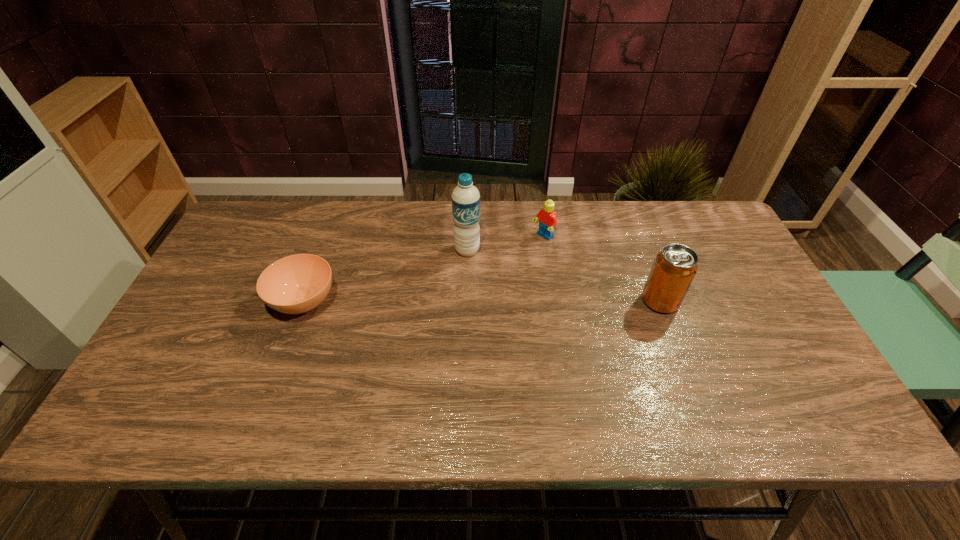
The height and width of the screenshot is (540, 960). Identify the location of vacant point located between the tallest object and the soup bowl. (386, 276).

Identify the location of empty location between the second shortest object and the rightmost object. (601, 269).

You are a GUI agent. You are given a task and a screenshot of the screen. Output one action in this format:
    pyautogui.click(x=<x>, y=<y>)
    Task: Click on the vacant region between the soda can and the second object from left to right
    This screenshot has width=960, height=540.
    Given the screenshot: What is the action you would take?
    pyautogui.click(x=564, y=276)

The height and width of the screenshot is (540, 960). What are the coordinates of `free space between the second tallest object and the shortest object` in the screenshot? It's located at (482, 301).

This screenshot has width=960, height=540. Identify the location of object that is the third closest to the soup bowl. (674, 268).

Find the location of a particular element. The height and width of the screenshot is (540, 960). the third closest object relative to the soda can is located at coordinates (296, 284).

Identify the location of free spot that satisfies the following two spatial constraints: 1. on the back side of the tallest object; 2. on the left side of the soup bowl. pos(323,251).

Image resolution: width=960 pixels, height=540 pixels. Find the location of `blank space that satisfies the following two spatial constraints: 1. on the back side of the water bottle; 2. on the left side of the soup bowl`. blank space that satisfies the following two spatial constraints: 1. on the back side of the water bottle; 2. on the left side of the soup bowl is located at coordinates (323, 251).